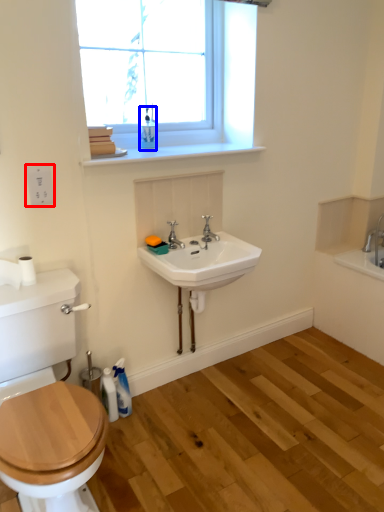
Question: Among these objects, which one is nearest to the camera, electric outlet (highlighted by a red box) or toiletry (highlighted by a blue box)?

Choices:
 (A) electric outlet
 (B) toiletry

Answer: (A)